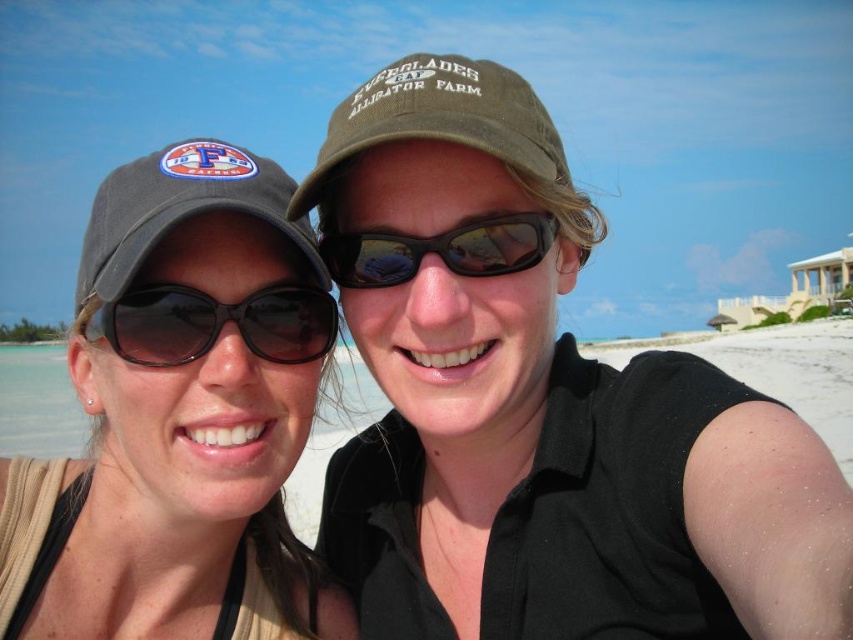
Question: Is matte green cap at upper center below matte gray cap at upper left?

Choices:
 (A) yes
 (B) no

Answer: (A)

Question: Is matte gray cap at upper left to the right of green fabric cap at upper center from the viewer's perspective?

Choices:
 (A) yes
 (B) no

Answer: (B)

Question: Based on their relative distances, which object is farther from the black matte sunglasses at center?

Choices:
 (A) matte green cap at upper center
 (B) green fabric cap at upper center

Answer: (A)

Question: Does matte green cap at upper center appear on the right side of black matte sunglasses at left?

Choices:
 (A) no
 (B) yes

Answer: (B)

Question: Among these points, which one is nearest to the camera?

Choices:
 (A) (131, 344)
 (B) (554, 179)

Answer: (A)

Question: Estimate the real-world distances between objects in this image. Which object is farther from the black matte sunglasses at left?

Choices:
 (A) matte gray baseball cap at left
 (B) matte gray cap at upper left

Answer: (B)